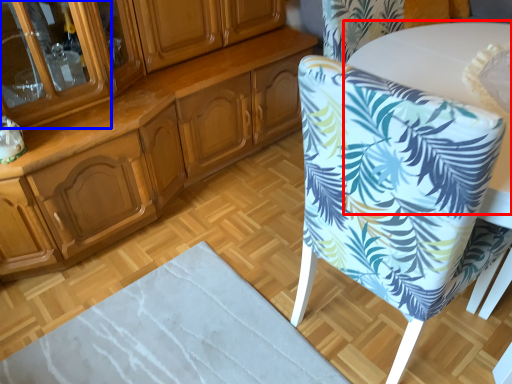
Question: Among these objects, which one is nearest to the camera, round table (highlighted by a red box) or glass door (highlighted by a blue box)?

Choices:
 (A) round table
 (B) glass door

Answer: (B)